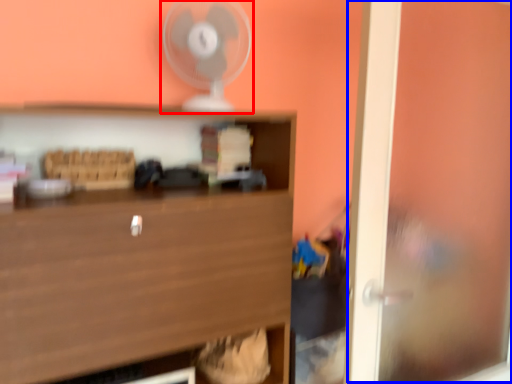
Question: Which of the following is the farthest to the observer, fan (highlighted by a red box) or window (highlighted by a blue box)?

Choices:
 (A) fan
 (B) window

Answer: (A)